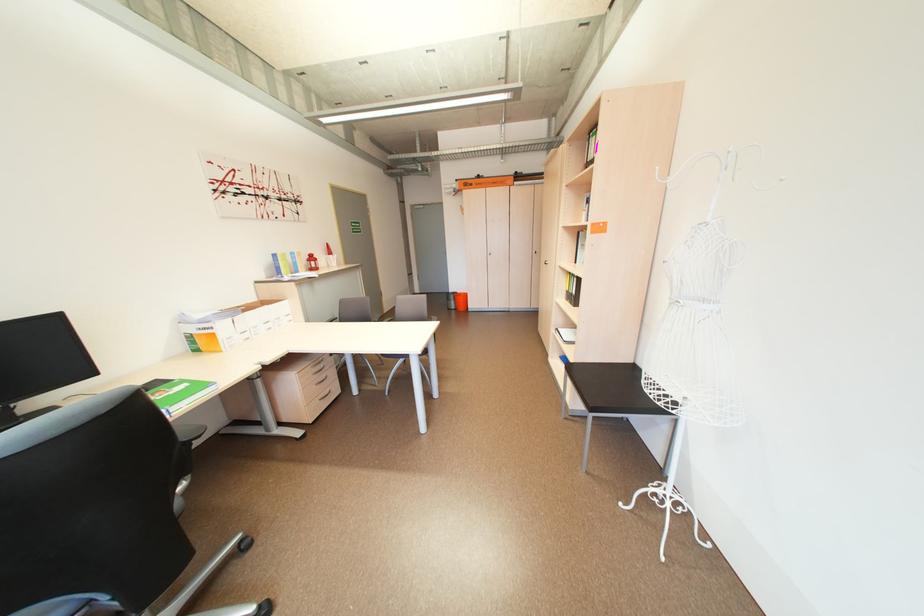
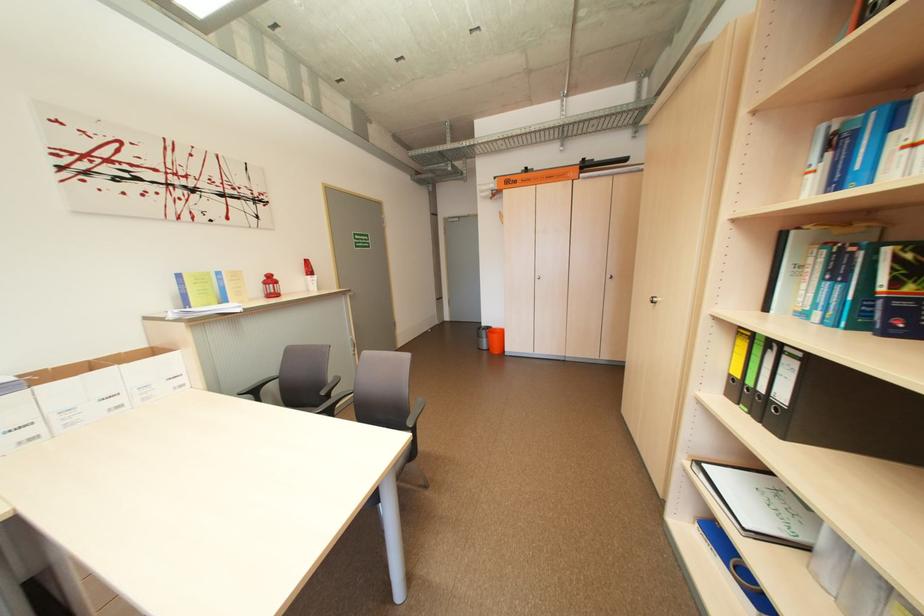
Where in the second image is the point corresponding to the point at 584,293 from the first image?

(792, 399)